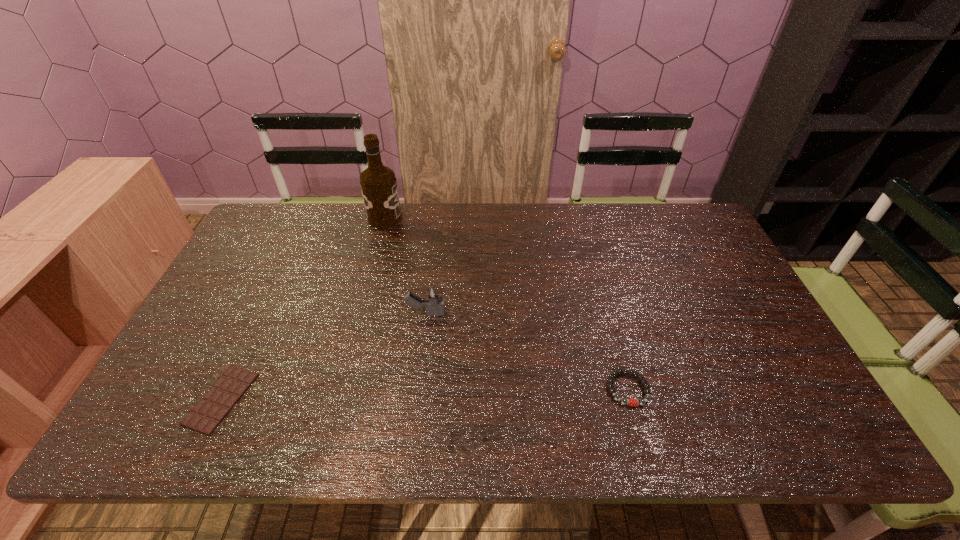
Image resolution: width=960 pixels, height=540 pixels. In order to click on empty space between the igniter and the rightmost object in this screenshot , I will do `click(527, 352)`.

This screenshot has height=540, width=960. In order to click on empty space that is in between the shortest object and the igniter in this screenshot , I will do `click(324, 356)`.

Identify which object is the nearest to the leftmost object. Please provide its 2D coordinates. Your answer should be formatted as a tuple, i.e. [(x, y)], where the tuple contains the x and y coordinates of a point satisfying the conditions above.

[(433, 300)]

Where is `the closest object to the rightmost object`? This screenshot has height=540, width=960. the closest object to the rightmost object is located at coordinates (433, 300).

Locate an element on the screen. The image size is (960, 540). free space that satisfies the following two spatial constraints: 1. on the front side of the rightmost object; 2. on the left side of the third object from left to right is located at coordinates (417, 389).

The width and height of the screenshot is (960, 540). Find the location of `free spot that satisfies the following two spatial constraints: 1. on the label of the tallest object; 2. on the back side of the third shortest object`. free spot that satisfies the following two spatial constraints: 1. on the label of the tallest object; 2. on the back side of the third shortest object is located at coordinates (360, 314).

Identify the location of free space that satisfies the following two spatial constraints: 1. on the label of the tallest object; 2. on the left side of the second shortest object. (341, 389).

Where is `free location that satisfies the following two spatial constraints: 1. on the label of the farthest object; 2. on the right side of the bracelet`? The height and width of the screenshot is (540, 960). free location that satisfies the following two spatial constraints: 1. on the label of the farthest object; 2. on the right side of the bracelet is located at coordinates (341, 389).

Where is `vacant space that satisfies the following two spatial constraints: 1. on the label of the second object from left to right; 2. on the front side of the chocolate bar`? vacant space that satisfies the following two spatial constraints: 1. on the label of the second object from left to right; 2. on the front side of the chocolate bar is located at coordinates (339, 399).